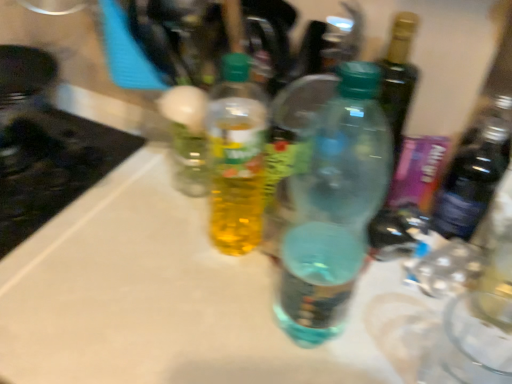
Question: Considering the positions of point (218, 91) and point (353, 177), is point (218, 91) closer or farther from the camera than point (353, 177)?

Choices:
 (A) closer
 (B) farther

Answer: (B)

Question: From a real-world perspective, is translucent plastic bottle at center, positioned as the first bottle in left-to-right order, physically located above or below translucent plastic bottle at center, the second bottle from the left?

Choices:
 (A) below
 (B) above

Answer: (A)

Question: Which object is positioned closest to the black glass stove at left?

Choices:
 (A) translucent plastic bottle at center, positioned as the first bottle in left-to-right order
 (B) translucent plastic bottle at center, the second bottle from the left

Answer: (A)

Question: Which object is the closest to the black glass stove at left?

Choices:
 (A) translucent plastic bottle at center, positioned as the first bottle in left-to-right order
 (B) translucent plastic bottle at center, acting as the 1th bottle starting from the right

Answer: (A)